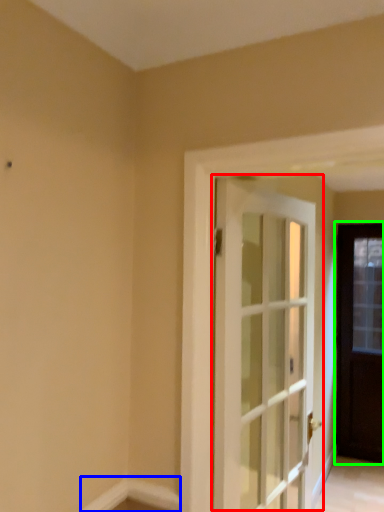
Question: Which is farther away from door (highlighted by a red box)? molding (highlighted by a blue box) or door (highlighted by a green box)?

Choices:
 (A) molding
 (B) door

Answer: (B)